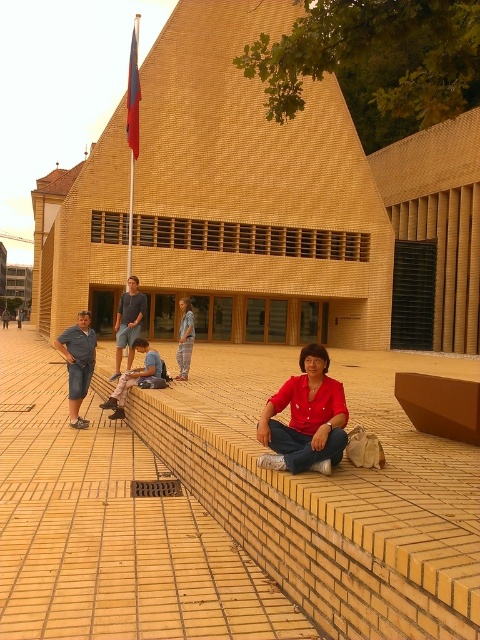
Question: Which point appears closest to the camera in this image?

Choices:
 (A) (72, 403)
 (B) (188, 365)

Answer: (A)

Question: Does matte red blouse at center appear under red fabric flag at upper left?

Choices:
 (A) no
 (B) yes

Answer: (B)

Question: Is matte red blouse at center thinner than denim shorts at left?

Choices:
 (A) no
 (B) yes

Answer: (A)

Question: Which of the following is the closest to the observer?

Choices:
 (A) denim pants at center
 (B) red fabric flag at upper left
 (C) denim shorts at center

Answer: (C)

Question: From the image, what is the correct spatial relationship of denim shorts at center in relation to red fabric flag at upper left?

Choices:
 (A) below
 (B) above

Answer: (A)

Question: Which point is closer to the camera?

Choices:
 (A) (76, 390)
 (B) (315, 381)

Answer: (B)